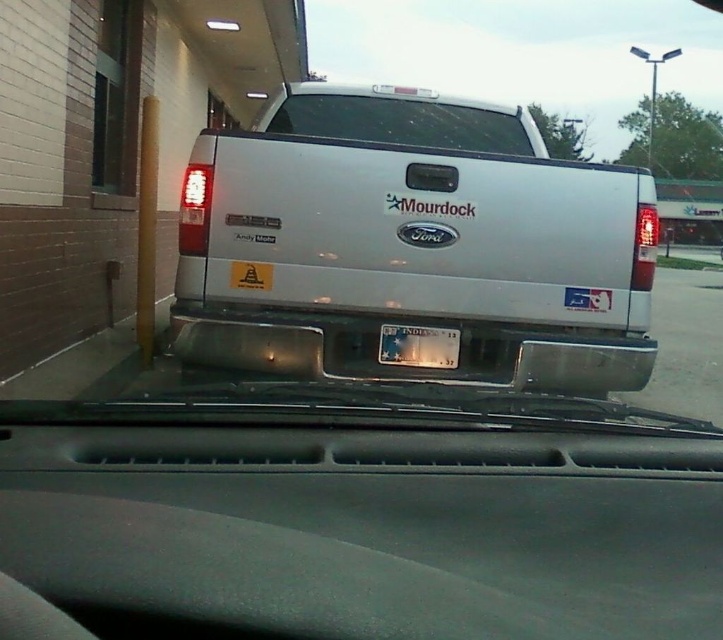
Question: Is clear glass windshield at center above white plastic license plate at center?

Choices:
 (A) yes
 (B) no

Answer: (A)

Question: Which of the following is the farthest from the observer?

Choices:
 (A) (283, 100)
 (B) (450, 355)
 (C) (268, 145)

Answer: (A)

Question: Is clear glass windshield at center behind white plastic license plate at center?

Choices:
 (A) yes
 (B) no

Answer: (A)

Question: Estimate the real-world distances between objects in this image. Which object is farther from the clear glass windshield at center?

Choices:
 (A) white plastic license plate at center
 (B) silver metallic pickup truck at center

Answer: (A)

Question: Can you confirm if clear glass windshield at center is thinner than white plastic license plate at center?

Choices:
 (A) no
 (B) yes

Answer: (A)

Question: Estimate the real-world distances between objects in this image. Which object is farther from the clear glass windshield at center?

Choices:
 (A) white plastic license plate at center
 (B) silver metallic pickup truck at center

Answer: (A)